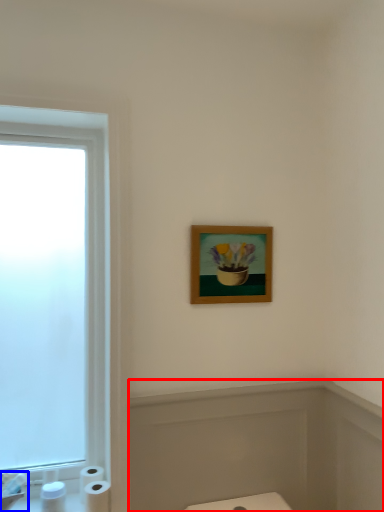
Question: Which point is further to the camera, bath (highlighted by a red box) or sink (highlighted by a blue box)?

Choices:
 (A) bath
 (B) sink

Answer: (A)